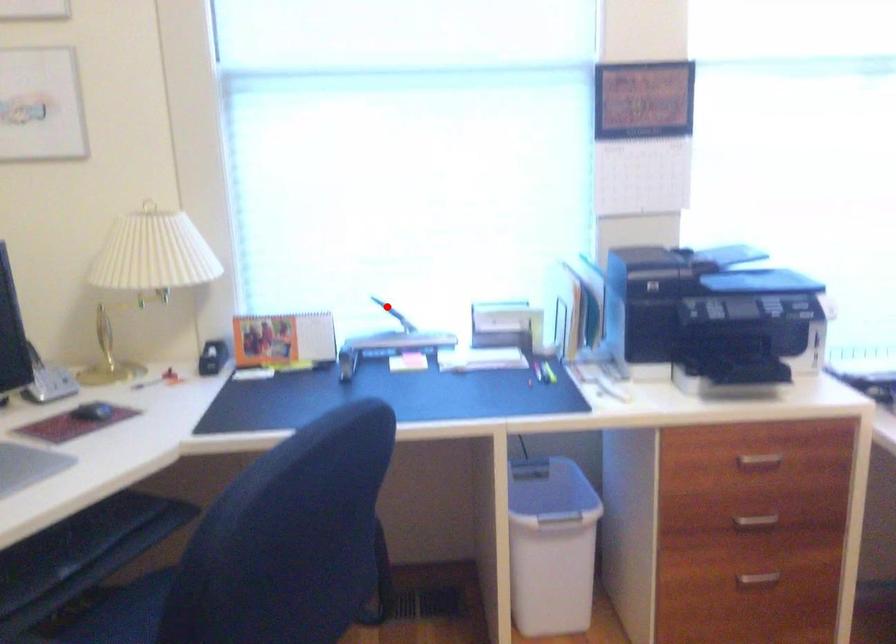
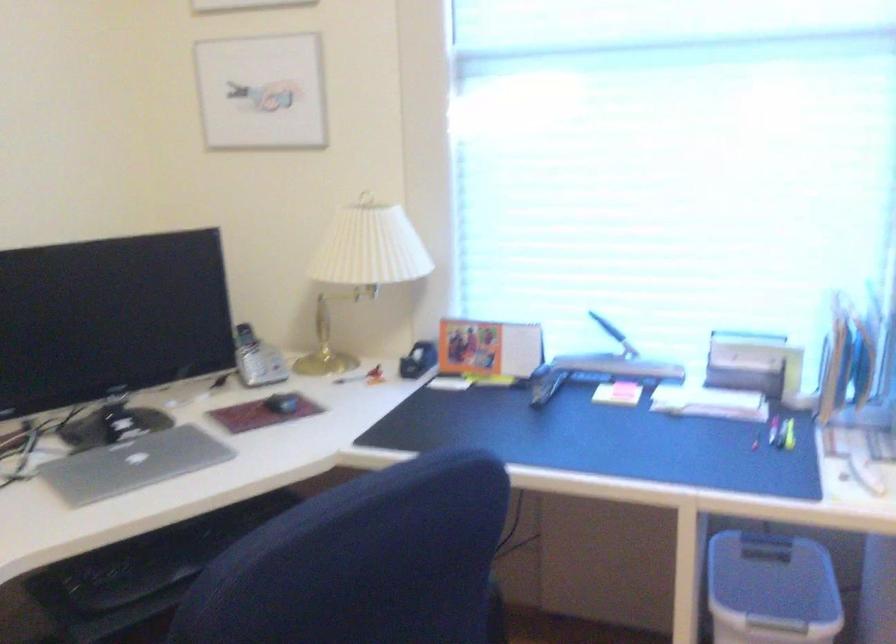
Question: I am providing you with two images of the same scene from different viewpoints. A red point is marked on the first image. At the location where the point appears in image 1, is it still visible in image 2?

Choices:
 (A) Yes
 (B) No

Answer: (A)